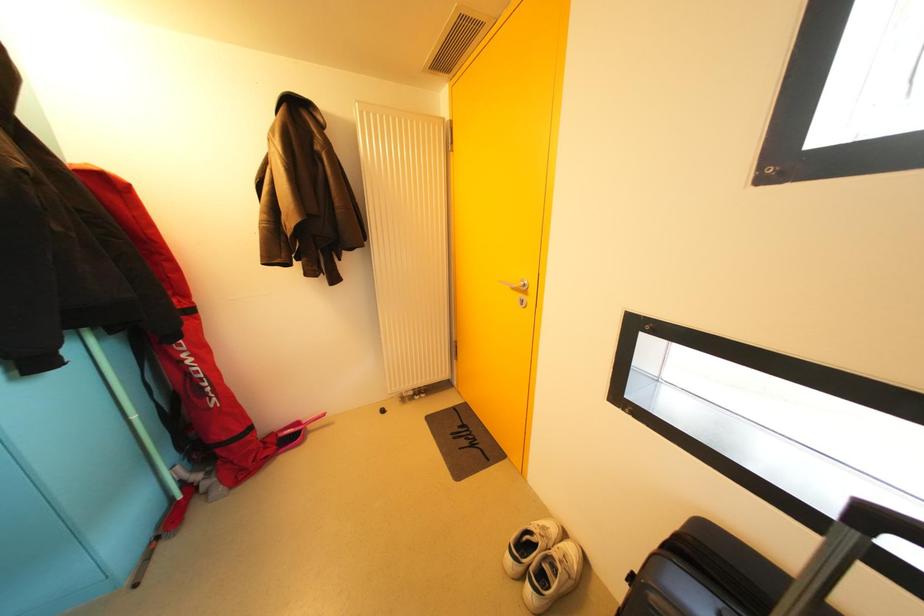
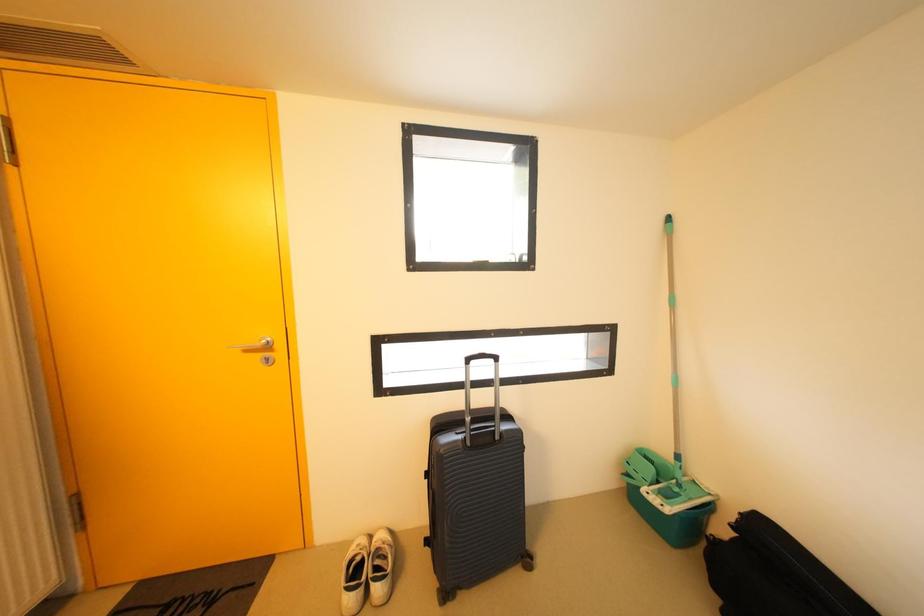
Question: The images are taken continuously from a first-person perspective. In which direction is your viewpoint rotating?

Choices:
 (A) Left
 (B) Right
 (C) Up
 (D) Down

Answer: (B)